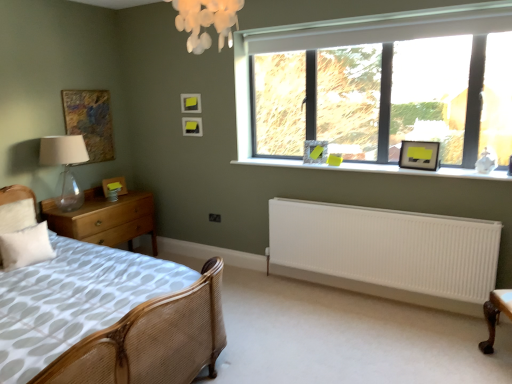
What are the coordinates of `free spot below matte black picture frame at upper right, the 5th picture frame when ordered from left to right (from a real-world perspective)` in the screenshot? It's located at (317, 161).